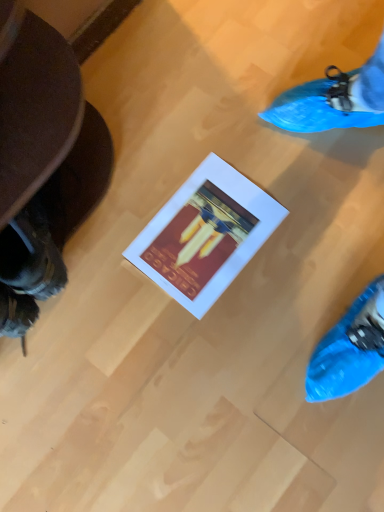
Find the location of `vacant area on the back side of white matte picture frame at center`. vacant area on the back side of white matte picture frame at center is located at coordinates (180, 136).